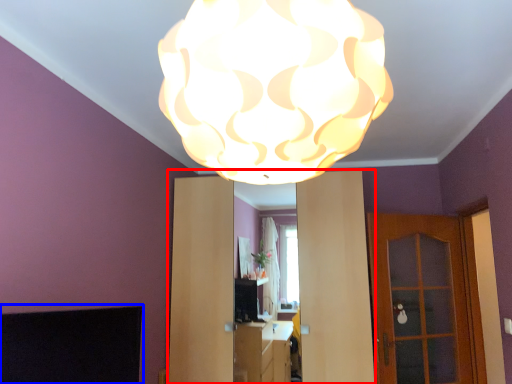
Question: Which object appears closest to the camera in this image, dresser (highlighted by a red box) or fireplace (highlighted by a blue box)?

Choices:
 (A) dresser
 (B) fireplace

Answer: (B)